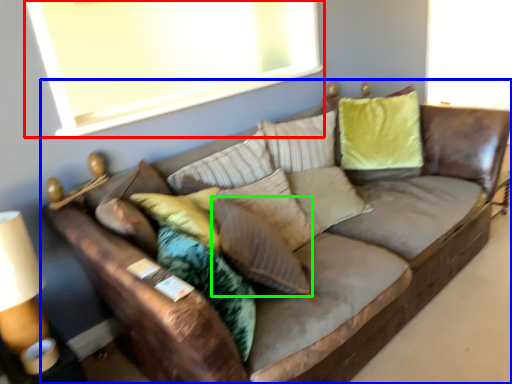
Question: Which is farther away from window screen (highlighted by a red box)? studio couch (highlighted by a blue box) or pillow (highlighted by a green box)?

Choices:
 (A) studio couch
 (B) pillow

Answer: (B)